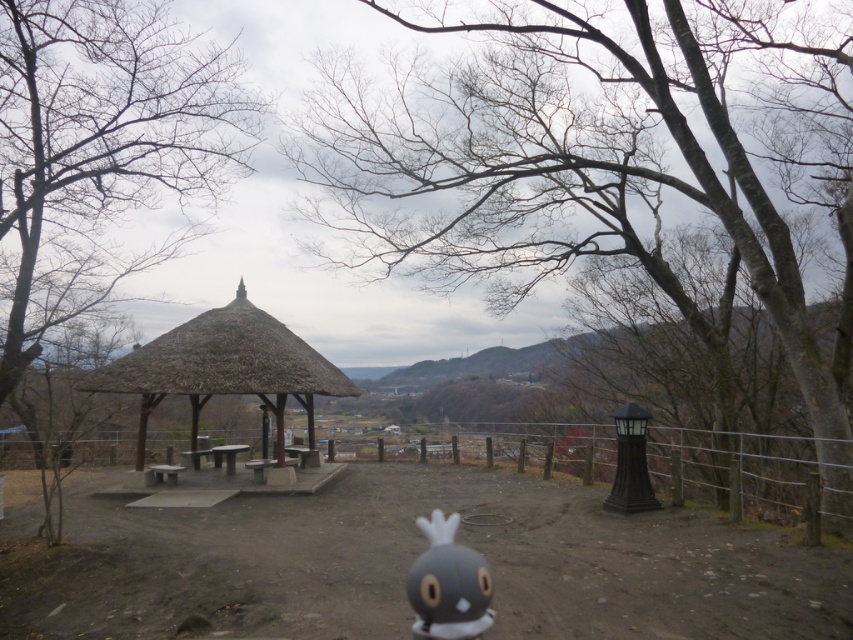
Question: Does bare branches at left appear over thatched wood gazebo at center?

Choices:
 (A) no
 (B) yes

Answer: (B)

Question: Which point is closer to the camera taking this photo?

Choices:
 (A) [16, 104]
 (B) [216, 321]

Answer: (A)

Question: Which point is closer to the camera?

Choices:
 (A) gray matte plush toy at center
 (B) wooden fence at center
 (C) bare branches at left

Answer: (A)

Question: Can you confirm if bare wood tree at center is bigger than thatched wood gazebo at center?

Choices:
 (A) yes
 (B) no

Answer: (A)

Question: Which of the following is the closest to the observer?

Choices:
 (A) gray matte plush toy at center
 (B) thatched wood gazebo at center
 (C) bare wood tree at center
 (D) wooden fence at center

Answer: (A)

Question: Can you confirm if bare wood tree at center is positioned above dull brown dirt at center?

Choices:
 (A) yes
 (B) no

Answer: (A)